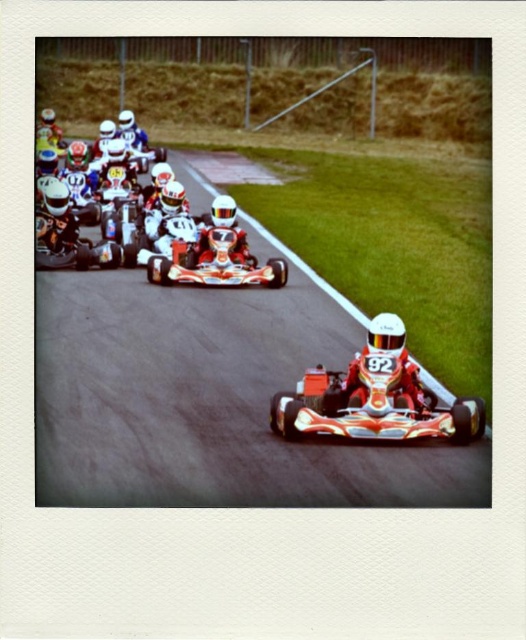
Question: Which is nearer to the smooth asphalt race track at upper center?

Choices:
 (A) white glossy number at center
 (B) shiny red helmet at center

Answer: (A)

Question: Can you confirm if orange glossy race car at center is positioned to the right of shiny orange go-kart at center?

Choices:
 (A) no
 (B) yes

Answer: (B)

Question: Which object is farther from the camera taking this photo?

Choices:
 (A) smooth asphalt race track at upper center
 (B) shiny red helmet at center
 (C) shiny orange go-kart at center

Answer: (B)

Question: Can you confirm if smooth asphalt race track at upper center is thinner than white glossy number at center?

Choices:
 (A) no
 (B) yes

Answer: (A)

Question: Which object is closer to the camera taking this photo?

Choices:
 (A) smooth asphalt race track at upper center
 (B) shiny orange go-kart at center
 (C) shiny red helmet at center
 (D) orange glossy race car at center

Answer: (A)

Question: Is smooth asphalt race track at upper center below orange glossy race car at center?

Choices:
 (A) no
 (B) yes

Answer: (A)